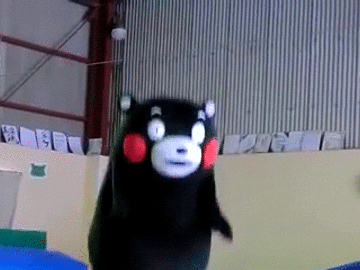
The image size is (360, 270). What are the coordinates of `green teddy bear sticker` in the screenshot? It's located at (37, 170).